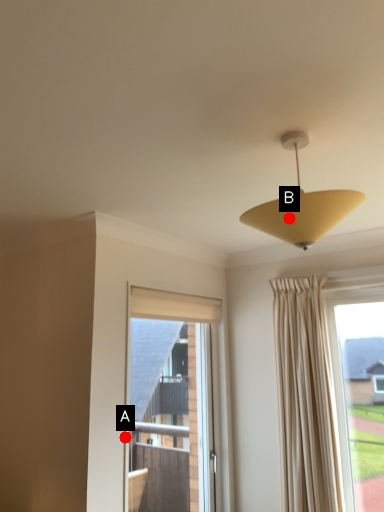
Question: Two points are circled on the image, labeled by A and B beside each circle. Which point is closer to the camera taking this photo?

Choices:
 (A) A is closer
 (B) B is closer

Answer: (B)